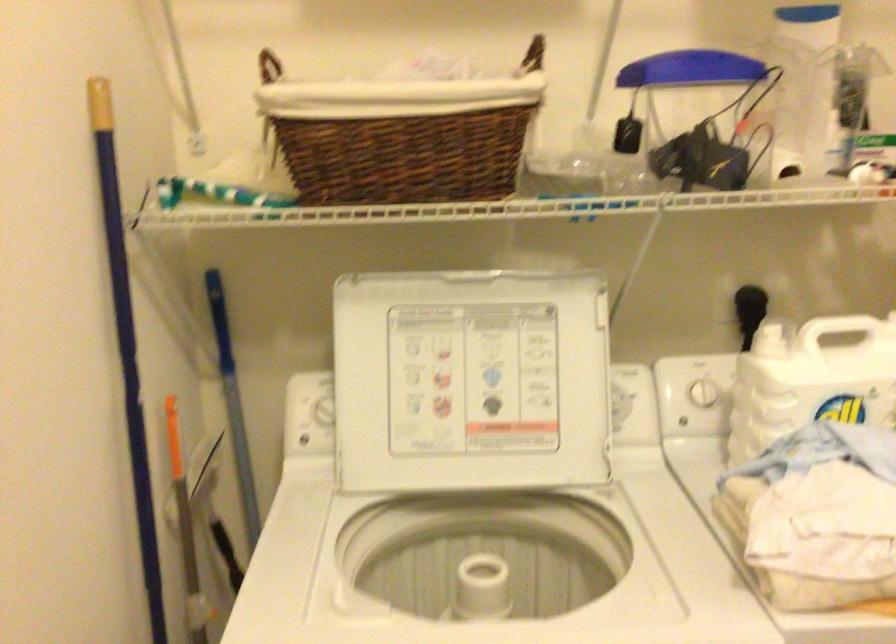
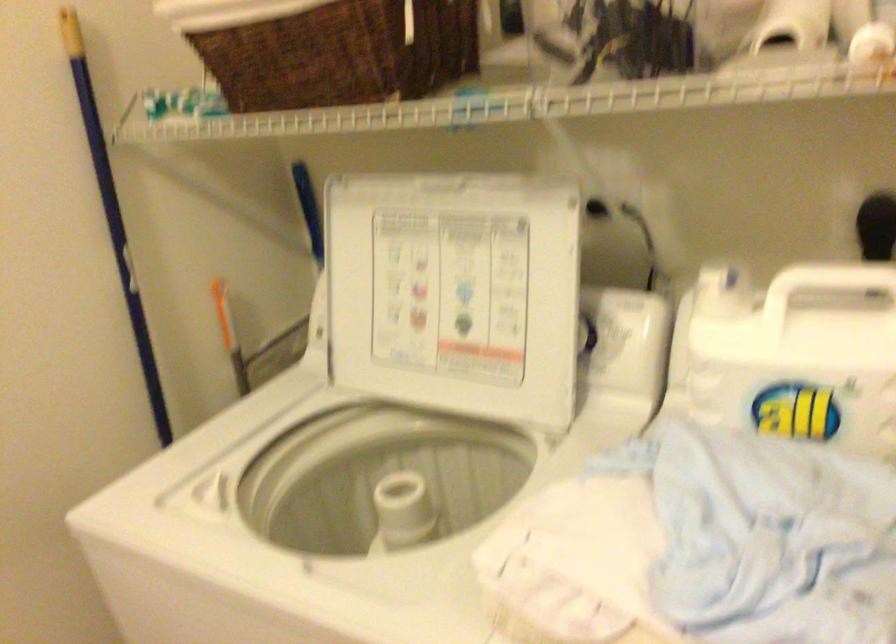
Find the pixel in the second image that matches point (131, 319) in the first image.

(113, 216)